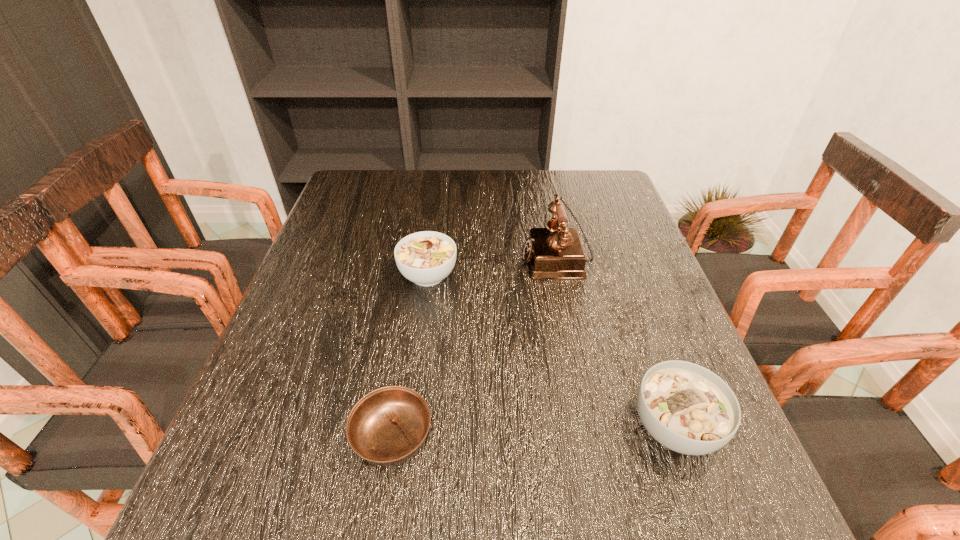
Locate which soup bowl is the second closest to the farthest soup bowl. Please provide its 2D coordinates. Your answer should be formatted as a tuple, i.e. [(x, y)], where the tuple contains the x and y coordinates of a point satisfying the conditions above.

[(687, 408)]

Identify which soup bowl is the third nearest to the tallest object. Please provide its 2D coordinates. Your answer should be formatted as a tuple, i.e. [(x, y)], where the tuple contains the x and y coordinates of a point satisfying the conditions above.

[(387, 426)]

Locate an element on the screen. This screenshot has height=540, width=960. free spot that satisfies the following two spatial constraints: 1. on the dial of the telephone; 2. on the front side of the shortest soup bowl is located at coordinates (593, 436).

This screenshot has height=540, width=960. I want to click on free spot that satisfies the following two spatial constraints: 1. on the dial of the tallest object; 2. on the front side of the farthest soup bowl, so click(561, 275).

The image size is (960, 540). Identify the location of blank area in the image that satisfies the following two spatial constraints: 1. on the back side of the shortest soup bowl; 2. on the right side of the farthest soup bowl. (418, 275).

Identify the location of vacant region that satisfies the following two spatial constraints: 1. on the front side of the farthest soup bowl; 2. on the left side of the rightmost soup bowl. Image resolution: width=960 pixels, height=540 pixels. (408, 427).